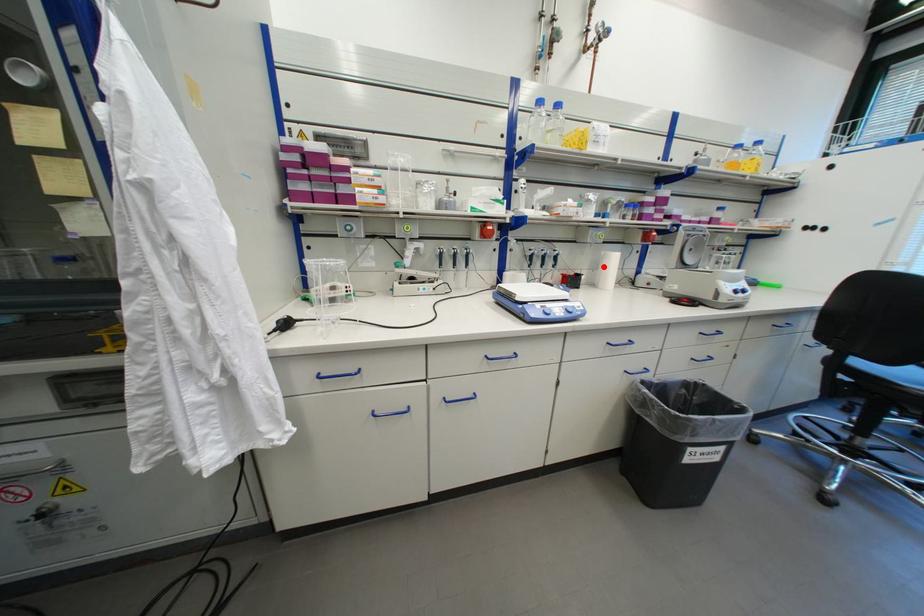
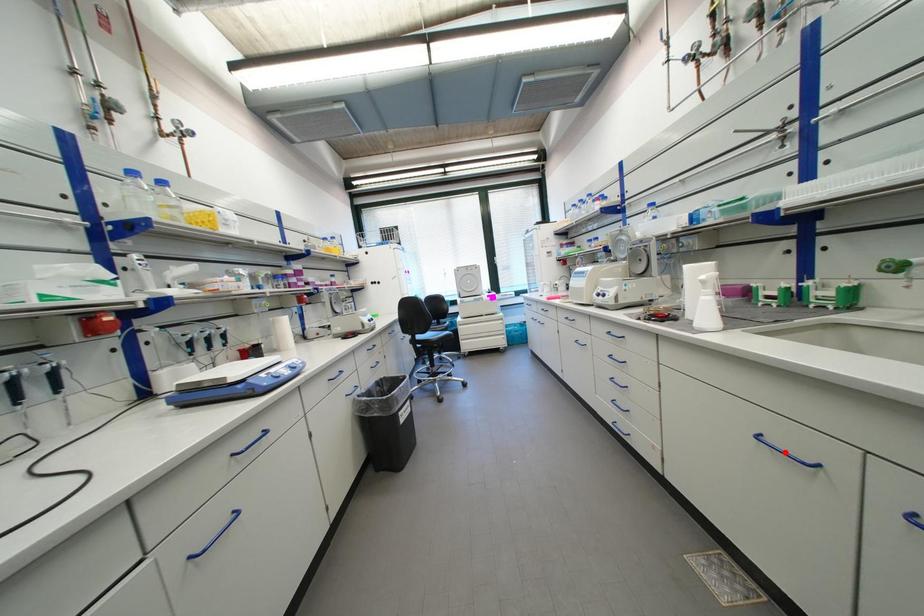
I am providing you with two images of the same scene from different viewpoints. A red point is marked on the first image and another point is marked on the second image. Are the points marked in image1 and image2 representing the same 3D position?

No